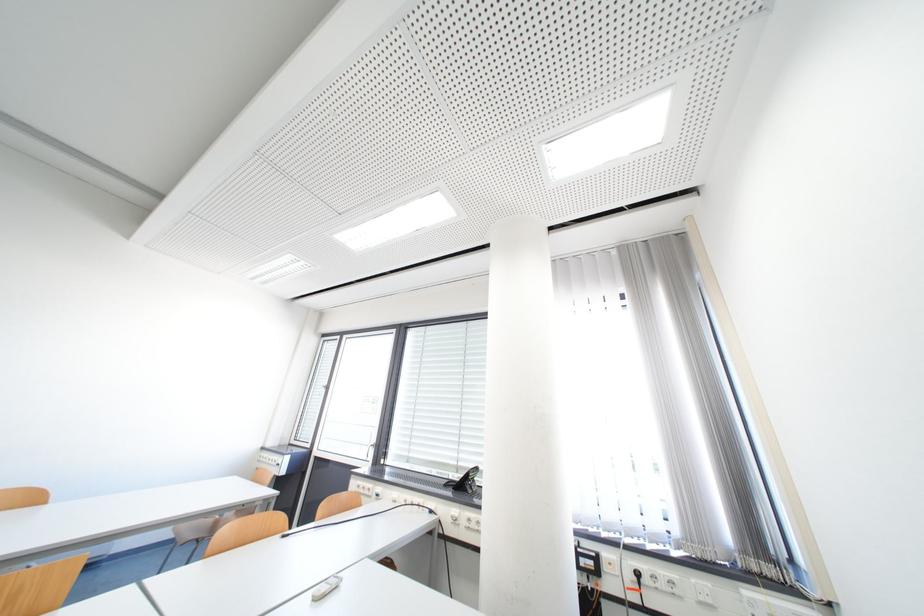
Where is `telephone handset`? The width and height of the screenshot is (924, 616). telephone handset is located at coordinates (467, 480).